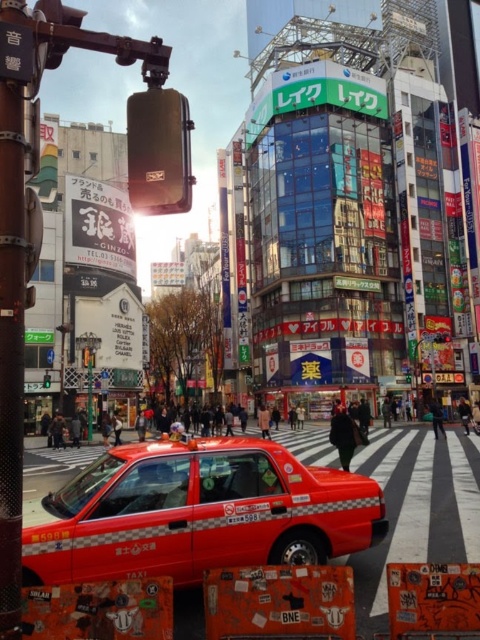
Between shiny red taxi at center and green glass traffic light at upper center, which one appears on the left side from the viewer's perspective?

From the viewer's perspective, green glass traffic light at upper center appears more on the left side.

What do you see at coordinates (199, 513) in the screenshot? This screenshot has width=480, height=640. I see `shiny red taxi at center` at bounding box center [199, 513].

Identify the location of shiny red taxi at center. The height and width of the screenshot is (640, 480). (x=199, y=513).

Image resolution: width=480 pixels, height=640 pixels. Find the location of `shiny red taxi at center`. shiny red taxi at center is located at coordinates (199, 513).

Is point (447, 333) less distant than point (43, 385)?

No, (447, 333) is further to viewer.

Between metallic rectangular at center and green glass traffic light at upper center, which one has less height?

Answer: With less height is metallic rectangular at center.

Is point (434, 333) less distant than point (48, 381)?

No, it is not.

Where is `metallic rectangular at center`? metallic rectangular at center is located at coordinates (442, 337).

Who is taller, shiny red taxi at center or metallic rectangular at center?

shiny red taxi at center

Who is more distant from viewer, (155,545) or (444,332)?

The point (444,332) is behind.

Which is in front, point (250, 484) or point (447, 340)?

Positioned in front is point (250, 484).

Locate an element on the screen. shiny red taxi at center is located at coordinates (199, 513).